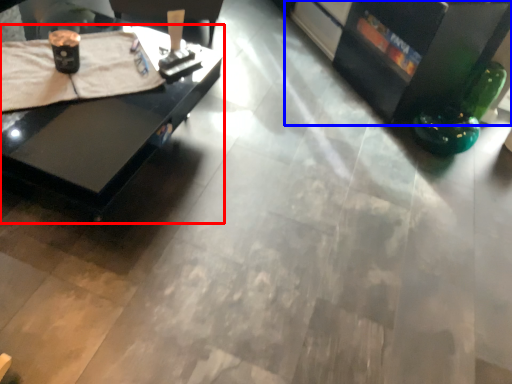
Question: Which object is closer to the camera taking this photo, table (highlighted by a red box) or entertainment center (highlighted by a blue box)?

Choices:
 (A) table
 (B) entertainment center

Answer: (A)